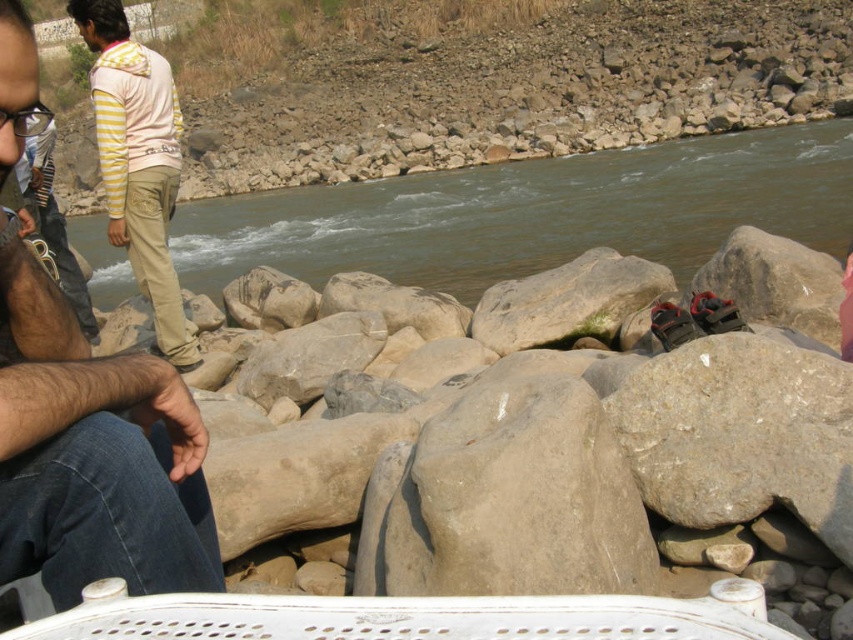
Question: Which object is closer to the camera taking this photo?

Choices:
 (A) greenish-brown water at center
 (B) light pink hoodie at upper left
 (C) beige cotton pants at center

Answer: (C)

Question: Does greenish-brown water at center have a smaller size compared to beige cotton pants at center?

Choices:
 (A) yes
 (B) no

Answer: (B)

Question: Which object is closer to the camera taking this photo?

Choices:
 (A) beige cotton pants at center
 (B) greenish-brown water at center

Answer: (A)

Question: Is greenish-brown water at center wider than light pink hoodie at upper left?

Choices:
 (A) yes
 (B) no

Answer: (A)

Question: Can you confirm if greenish-brown water at center is positioned to the right of beige cotton pants at center?

Choices:
 (A) no
 (B) yes

Answer: (B)

Question: Which object is positioned farthest from the greenish-brown water at center?

Choices:
 (A) beige cotton pants at center
 (B) light pink hoodie at upper left

Answer: (B)